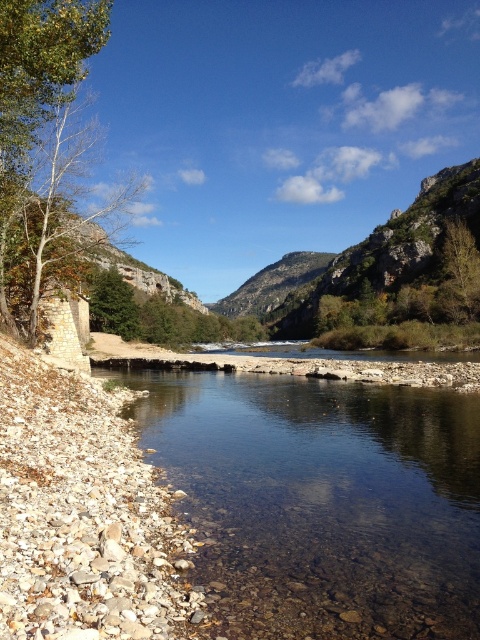
Question: Does clear water at center have a lesser width compared to rocky cliff at upper center?

Choices:
 (A) yes
 (B) no

Answer: (A)

Question: Where is clear water at center located in relation to rocky cliff at upper center in the image?

Choices:
 (A) left
 (B) right

Answer: (A)

Question: Is clear water at center in front of rocky cliff at upper center?

Choices:
 (A) no
 (B) yes

Answer: (B)

Question: Which of the following is the farthest from the observer?

Choices:
 (A) clear water at center
 (B) rocky cliff at upper center

Answer: (B)

Question: Which of the following is the farthest from the observer?

Choices:
 (A) clear water at center
 (B) rocky cliff at upper center

Answer: (B)

Question: Which point appears farthest from the camera in this image?

Choices:
 (A) (440, 499)
 (B) (238, 317)

Answer: (B)